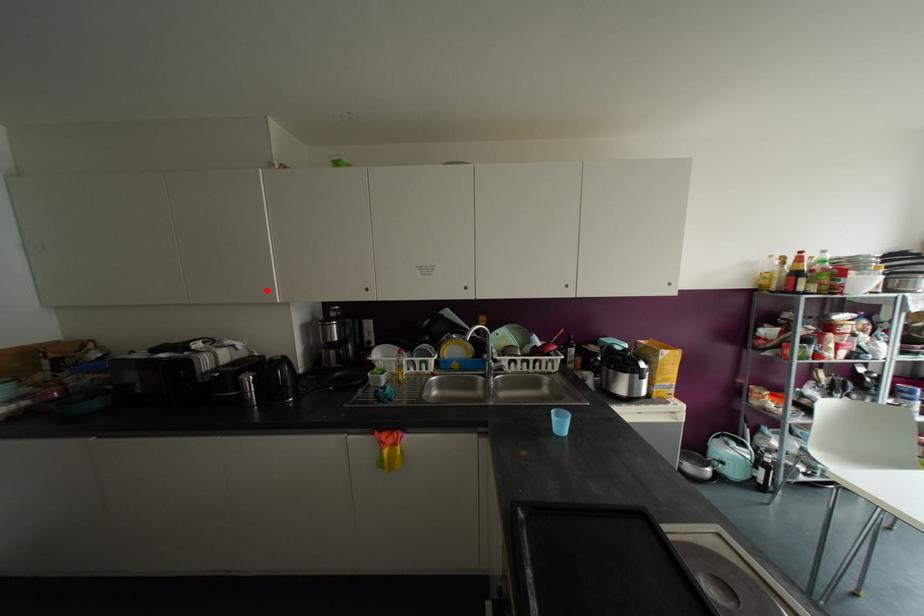
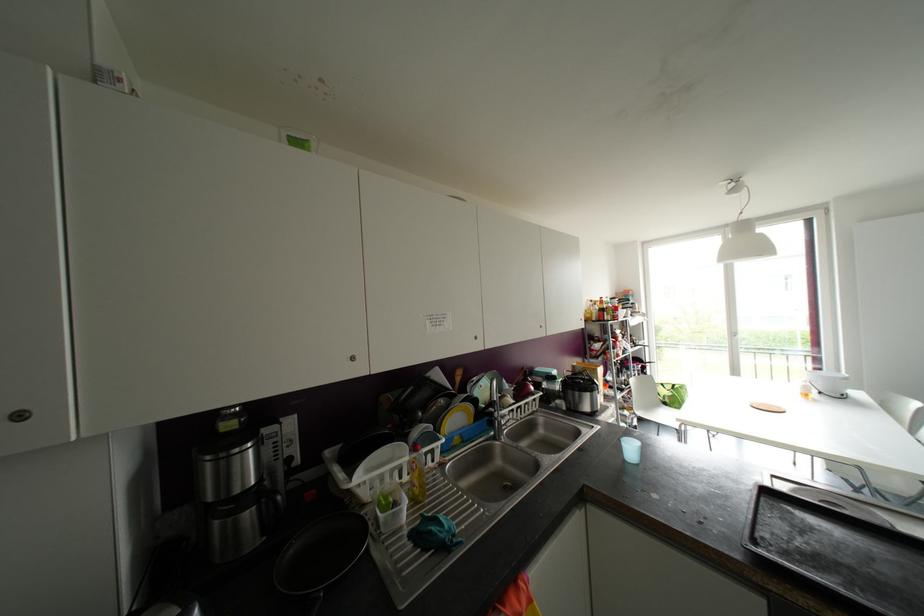
In the second image, find the point that corresponds to the highlighted location in the first image.

(19, 416)